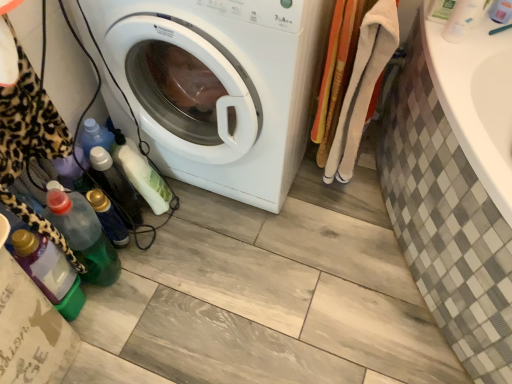
I want to click on vacant area situated below soft cotton towels at right (from a real-world perspective), so click(x=334, y=193).